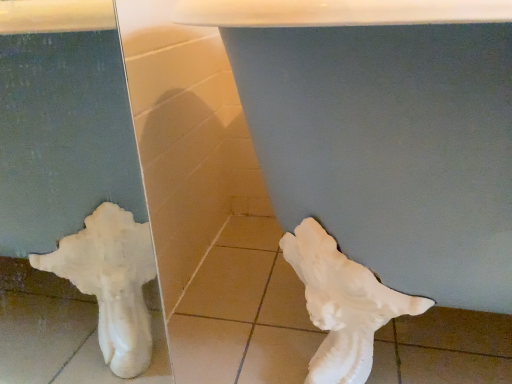
This screenshot has height=384, width=512. Find the location of `white matte sculpture at lower left`. white matte sculpture at lower left is located at coordinates (385, 131).

The height and width of the screenshot is (384, 512). Describe the element at coordinates (385, 131) in the screenshot. I see `white matte sculpture at lower left` at that location.

Identify the location of white matte sculpture at lower left. (385, 131).